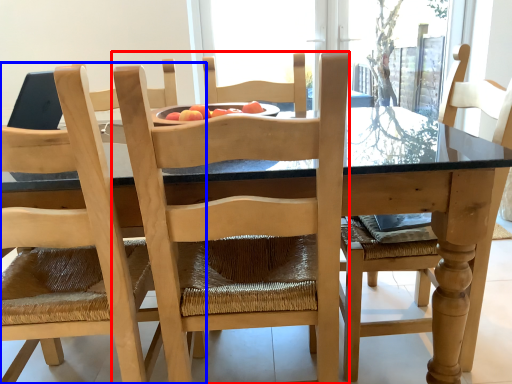
Question: Among these objects, which one is nearest to the camera, chair (highlighted by a red box) or chair (highlighted by a blue box)?

Choices:
 (A) chair
 (B) chair

Answer: (B)